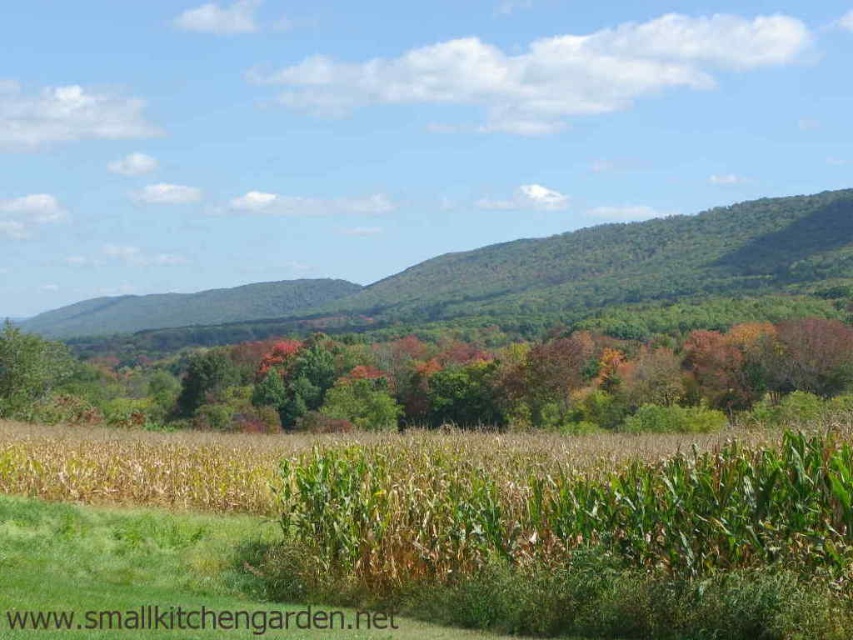
Who is positioned more to the right, green leafy corn at center or green leafy forest at center?

green leafy corn at center is more to the right.

Does point (438, 458) come behind point (366, 288)?

No, (438, 458) is in front of (366, 288).

Between point (756, 627) and point (740, 268), which one is positioned behind?

Point (740, 268)

Identify the location of green leafy corn at center. Image resolution: width=853 pixels, height=640 pixels. (444, 529).

Is green matte tree at center bigger than green leafy forest at center?

Actually, green matte tree at center might be smaller than green leafy forest at center.

Which is more to the left, green matte tree at center or green leafy forest at center?

green matte tree at center is more to the left.

Image resolution: width=853 pixels, height=640 pixels. I want to click on green matte tree at center, so click(x=436, y=380).

From the picture: Which of these two, green leafy corn at center or green matte tree at center, stands taller?

Standing taller between the two is green matte tree at center.

Does green leafy corn at center have a larger size compared to green matte tree at center?

No.

The height and width of the screenshot is (640, 853). I want to click on green leafy corn at center, so click(x=444, y=529).